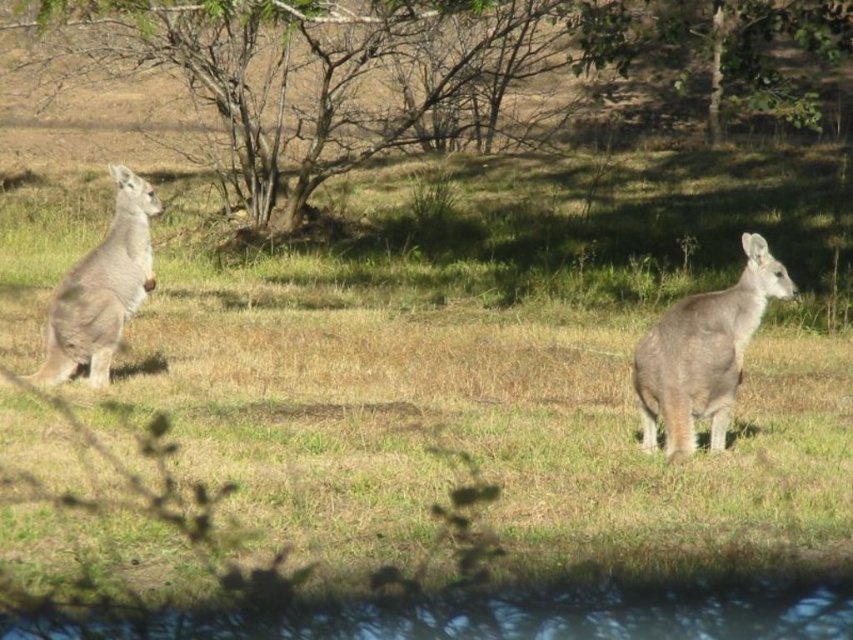
Who is positioned more to the left, green grass at center or gray fur kangaroo at right?

Positioned to the left is green grass at center.

Between green grass at center and gray fur kangaroo at right, which one has less height?

With less height is gray fur kangaroo at right.

Who is more forward, (492, 515) or (737, 289)?

Point (492, 515)

Where is `green grass at center`? The height and width of the screenshot is (640, 853). green grass at center is located at coordinates (505, 371).

Does brown bark tree at upper center have a greater height compared to gray fur kangaroo at right?

Indeed, brown bark tree at upper center has a greater height compared to gray fur kangaroo at right.

Which of these two, brown bark tree at upper center or gray fur kangaroo at right, stands shorter?

With less height is gray fur kangaroo at right.

The height and width of the screenshot is (640, 853). In order to click on brown bark tree at upper center in this screenshot , I will do `click(432, 65)`.

Locate an element on the screen. brown bark tree at upper center is located at coordinates (432, 65).

Is gray fur kangaroo at right further to camera compared to gray furry kangaroo at left?

No, it is in front of gray furry kangaroo at left.

Which is behind, point (708, 410) or point (144, 256)?

The point (144, 256) is behind.

Identify the location of gray fur kangaroo at right. The width and height of the screenshot is (853, 640). (703, 353).